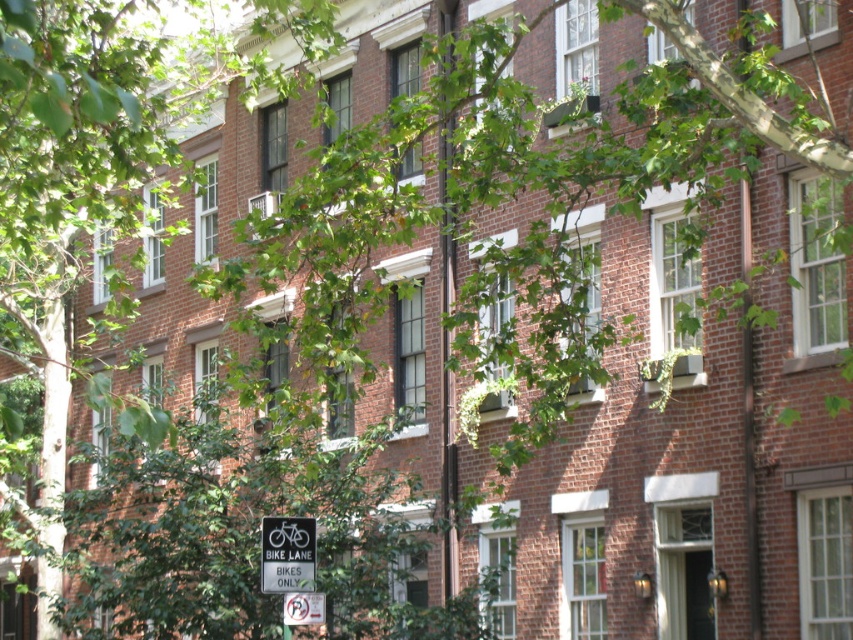
Consider the image. Is white plastic sign at lower left closer to the viewer compared to white paper sign at lower center?

Yes, white plastic sign at lower left is in front of white paper sign at lower center.

Does white plastic sign at lower left appear on the right side of white paper sign at lower center?

No, white plastic sign at lower left is not to the right of white paper sign at lower center.

You are a GUI agent. You are given a task and a screenshot of the screen. Output one action in this format:
    pyautogui.click(x=<x>, y=<y>)
    Task: Click on the white plastic sign at lower left
    
    Given the screenshot: What is the action you would take?
    pyautogui.click(x=287, y=554)